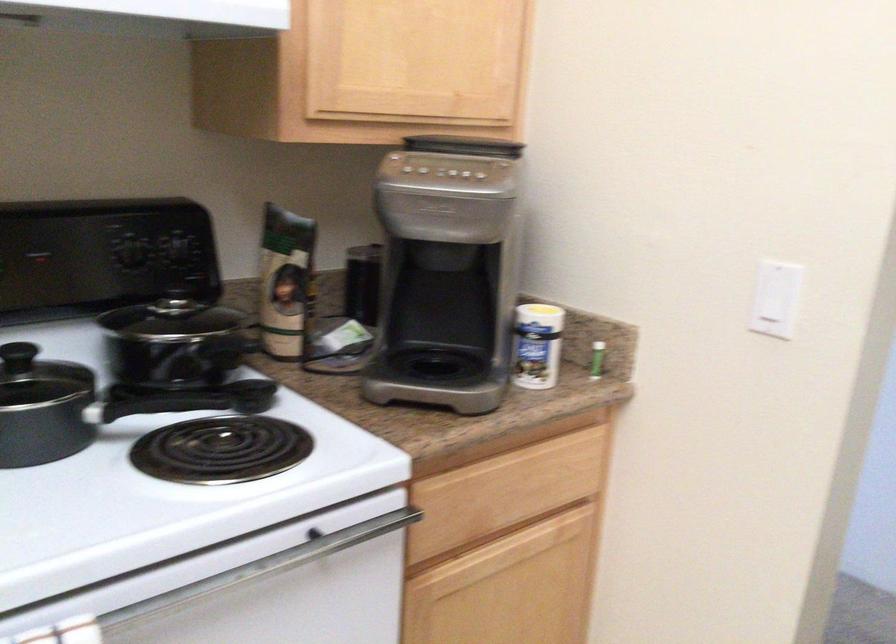
What do you see at coordinates (769, 310) in the screenshot?
I see `a white light switch` at bounding box center [769, 310].